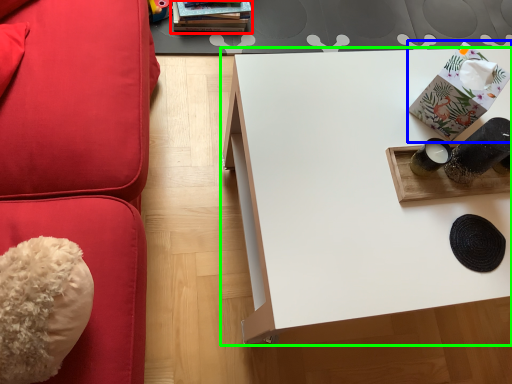
Question: Which object is the closest to the book (highlighted by a red box)? Choose among these: package (highlighted by a blue box) or table (highlighted by a green box).

Choices:
 (A) package
 (B) table

Answer: (B)